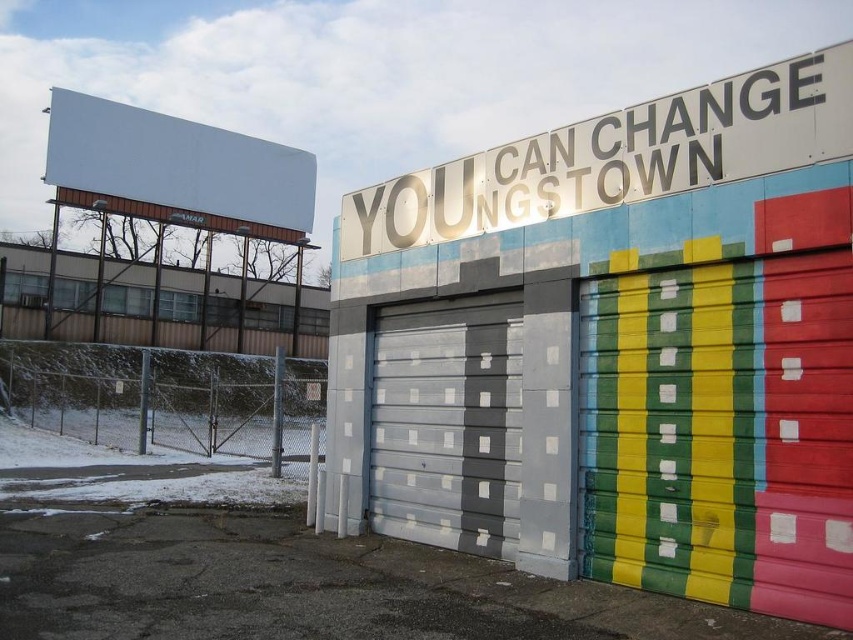
You are standing in front of the building and want to locate the metallic silver sign at upper center. According to the coordinates given, where should you look relative to the building?

The metallic silver sign at upper center is located at coordinates point (618, 157), which means it is positioned slightly to the left and lower middle section of the building.

You are standing in front of the building and want to locate the metallic silver sign at upper center and the gray matte garage door at center. Based on their positions, which object is closer to the right side of the building?

The metallic silver sign at upper center is closer to the right side of the building because it is positioned to the right of the gray matte garage door at center.

You are standing in front of the building and want to hang a new banner between the metallic silver sign at upper center and the gray matte garage door at center. Given that the banner requires 5 feet of space to hang properly, will there be enough space between them?

The metallic silver sign at upper center is 5.74 feet away from the gray matte garage door at center, so yes, there is enough space to hang the banner between them since the distance is greater than the required 5 feet.